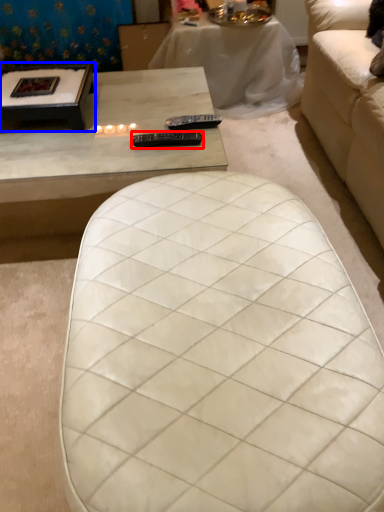
Question: Which object appears closest to the camera in this image, remote (highlighted by a red box) or coffee table (highlighted by a blue box)?

Choices:
 (A) remote
 (B) coffee table

Answer: (A)